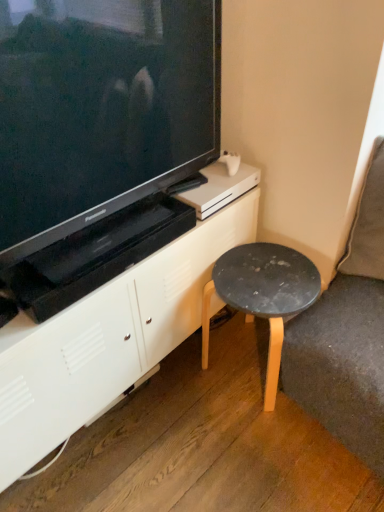
I want to click on vacant area on top of black matte stool at lower right (from a real-world perspective), so click(x=263, y=274).